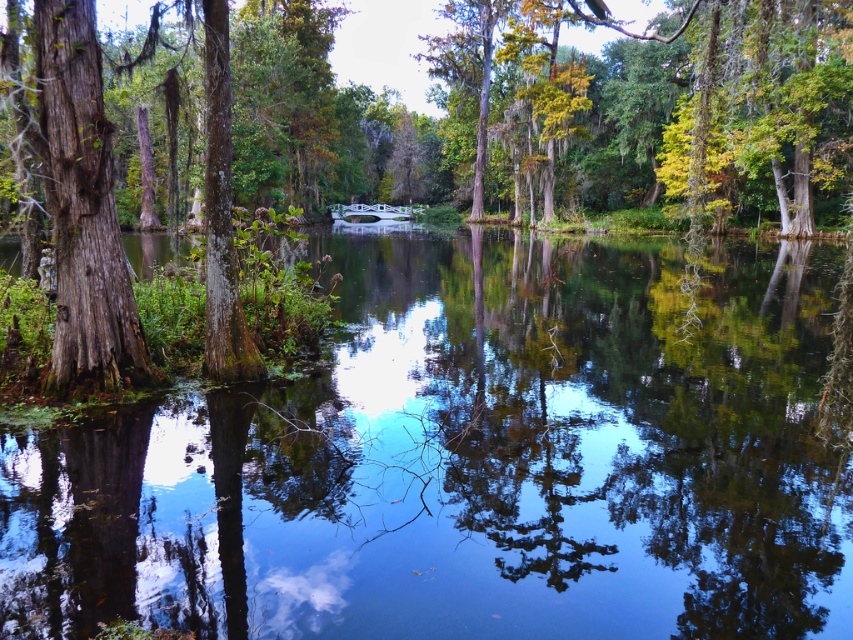
Is the position of clear water at center less distant than that of white glossy bridge at center?

Yes, clear water at center is closer to the viewer.

From the picture: Who is shorter, clear water at center or white glossy bridge at center?

With less height is clear water at center.

Describe the element at coordinates (469, 461) in the screenshot. I see `clear water at center` at that location.

This screenshot has width=853, height=640. What are the coordinates of `clear water at center` in the screenshot? It's located at (469, 461).

Which is below, smooth bark tree at left or white glossy bridge at center?

smooth bark tree at left is below.

Between smooth bark tree at left and white glossy bridge at center, which one has more height?

white glossy bridge at center is taller.

Who is more forward, (x=39, y=17) or (x=403, y=205)?

Point (x=39, y=17)

Where is `smooth bark tree at left`? The height and width of the screenshot is (640, 853). smooth bark tree at left is located at coordinates 82,205.

Between point (798, 106) and point (50, 177), which one is positioned behind?

The point (798, 106) is more distant.

Identify the location of smooth bark tree at center. (566, 113).